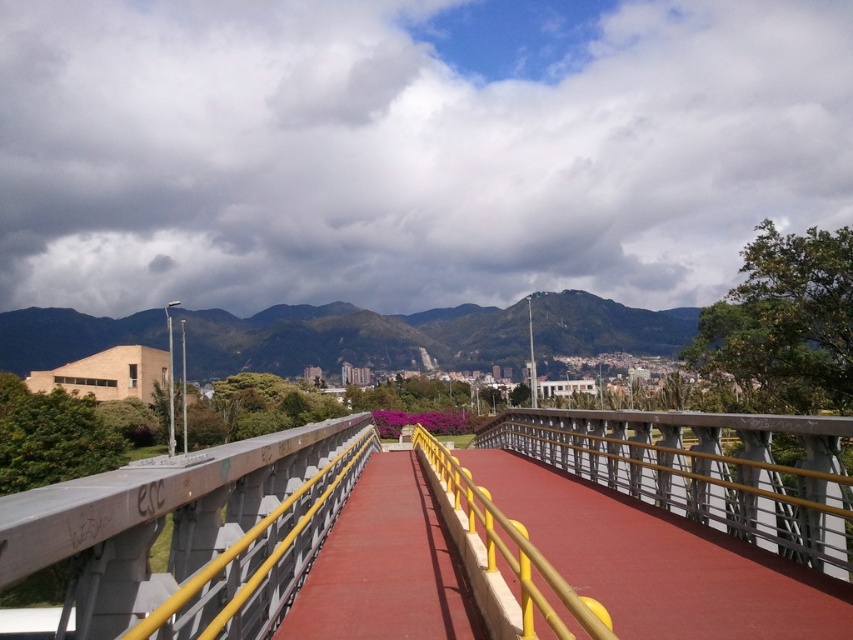
From the picture: Which is more to the left, concrete bridge at center or red rubber path at center?

Positioned to the left is concrete bridge at center.

Is point (518, 561) closer to viewer compared to point (424, 492)?

Yes.

The height and width of the screenshot is (640, 853). I want to click on concrete bridge at center, so click(x=189, y=532).